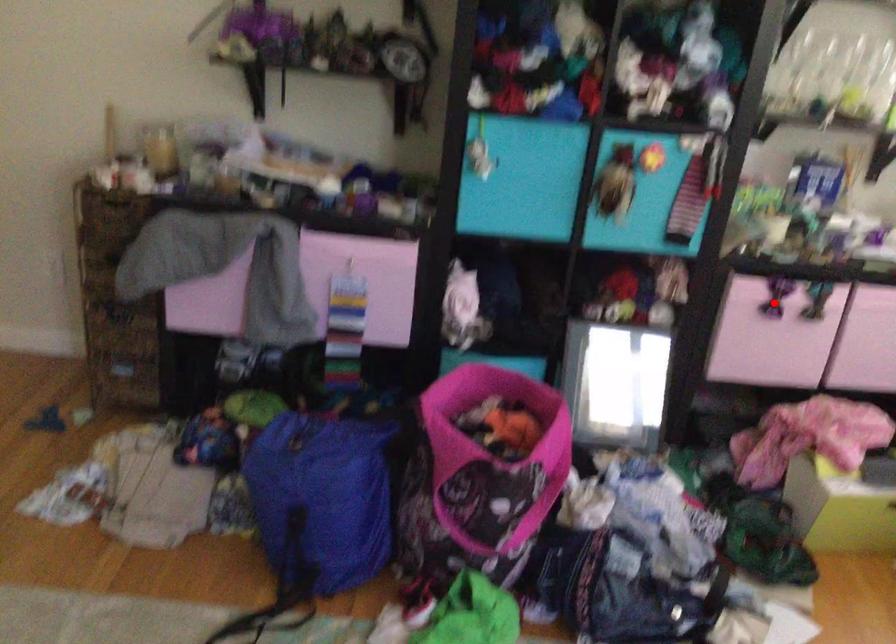
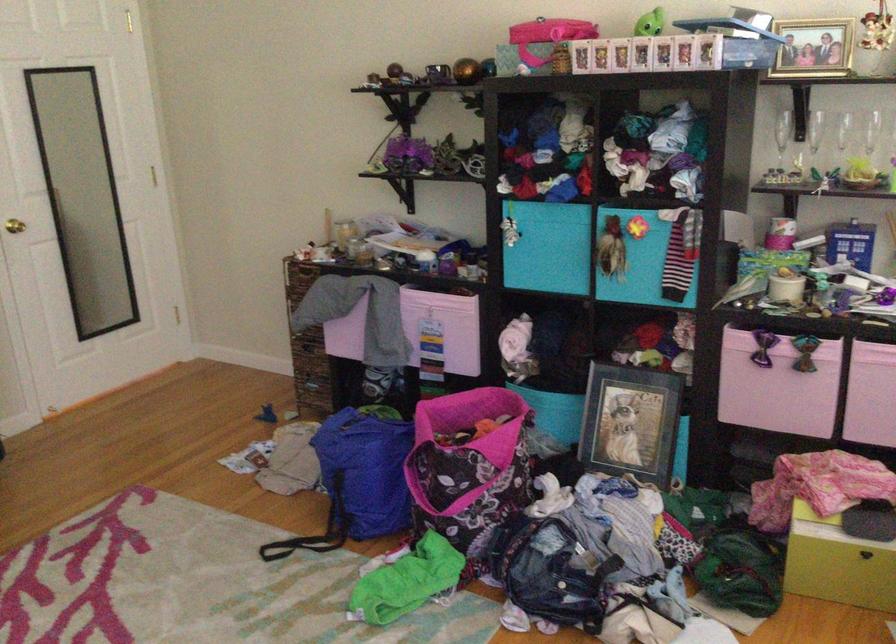
The point at the highlighted location is marked in the first image. Where is the corresponding point in the second image?

(762, 353)